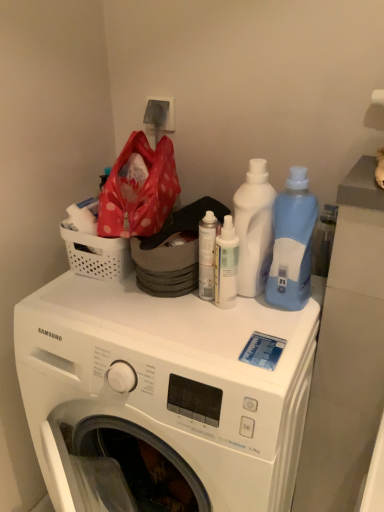
Locate an element on the screen. This screenshot has width=384, height=512. vacant position to the left of white glossy spray can at center, arranged as the 3th cleaning product when viewed from the right is located at coordinates (142, 314).